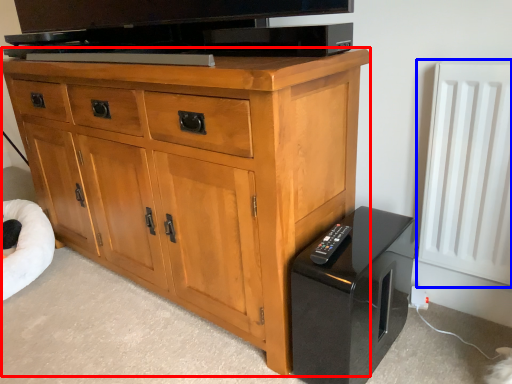
Question: Which object appears farthest to the camera in this image, chest of drawers (highlighted by a red box) or radiator (highlighted by a blue box)?

Choices:
 (A) chest of drawers
 (B) radiator

Answer: (B)